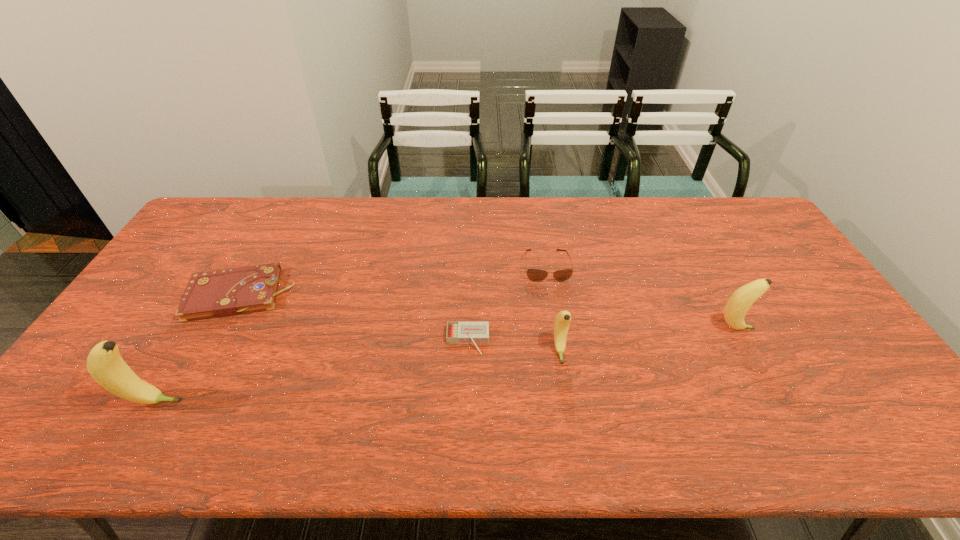
Locate an element on the screen. The width and height of the screenshot is (960, 540). unoccupied position between the third object from left to right and the third shortest object is located at coordinates (507, 303).

Where is `vacant area that lies between the shortest banana and the third object from left to right`? The width and height of the screenshot is (960, 540). vacant area that lies between the shortest banana and the third object from left to right is located at coordinates [x=514, y=346].

Identify the location of free spot between the third object from left to right and the leftmost banana. (311, 371).

The image size is (960, 540). Identify the location of free space between the nearest banana and the notebook. (197, 348).

Where is `unoccupied position between the fifth tallest object and the sunglasses`? unoccupied position between the fifth tallest object and the sunglasses is located at coordinates (394, 280).

Choose which object is the second nearest neighbor to the fifth shortest object. Please provide its 2D coordinates. Your answer should be formatted as a tuple, i.e. [(x, y)], where the tuple contains the x and y coordinates of a point satisfying the conditions above.

[(562, 321)]

You are a GUI agent. You are given a task and a screenshot of the screen. Output one action in this format:
    pyautogui.click(x=<x>, y=<y>)
    Task: Click on the object that is the fourth closest to the second farthest banana
    
    Given the screenshot: What is the action you would take?
    pyautogui.click(x=221, y=293)

Locate an element on the screen. This screenshot has width=960, height=540. banana that can be found as the second closest to the sunglasses is located at coordinates (739, 303).

Image resolution: width=960 pixels, height=540 pixels. Find the location of `banana that stands as the second closest to the second banana from left to right`. banana that stands as the second closest to the second banana from left to right is located at coordinates (104, 363).

The image size is (960, 540). What are the coordinates of `free space in the image that satisfies the following two spatial constraints: 1. from the stem of the fourth shortest object; 2. from the stem of the tallest banana` in the screenshot? It's located at (567, 402).